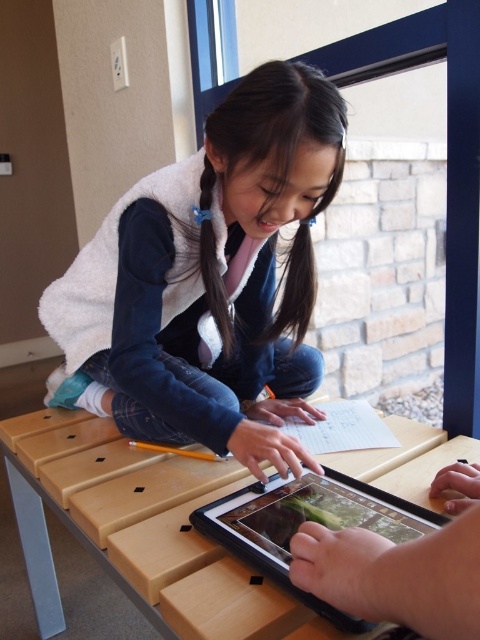
Between white fleece vest at center and black glossy tablet at lower center, which one is positioned higher?

white fleece vest at center

Is white fleece vest at center positioned at the back of black glossy tablet at lower center?

Yes, it is behind black glossy tablet at lower center.

You are a GUI agent. You are given a task and a screenshot of the screen. Output one action in this format:
    pyautogui.click(x=<x>, y=<y>)
    Task: Click on the white fleece vest at center
    
    Given the screenshot: What is the action you would take?
    pyautogui.click(x=212, y=280)

Is white fleece vest at center wider than wooden table at center?

No.

Does white fleece vest at center appear under wooden table at center?

Incorrect, white fleece vest at center is not positioned below wooden table at center.

Is point (275, 189) positioned behind point (348, 456)?

No, (275, 189) is in front of (348, 456).

At what (x,y) coordinates should I click in order to perform the action: click on white fleece vest at center. Please return your answer as a coordinate pair (x, y). The height and width of the screenshot is (640, 480). Looking at the image, I should click on (212, 280).

Is point (120, 506) more distant than point (211, 531)?

Yes, it is behind point (211, 531).

Is point (379, 452) farther from viewer compared to point (311, 488)?

Yes, it is behind point (311, 488).

Find the location of `wooden table at center`. wooden table at center is located at coordinates (139, 532).